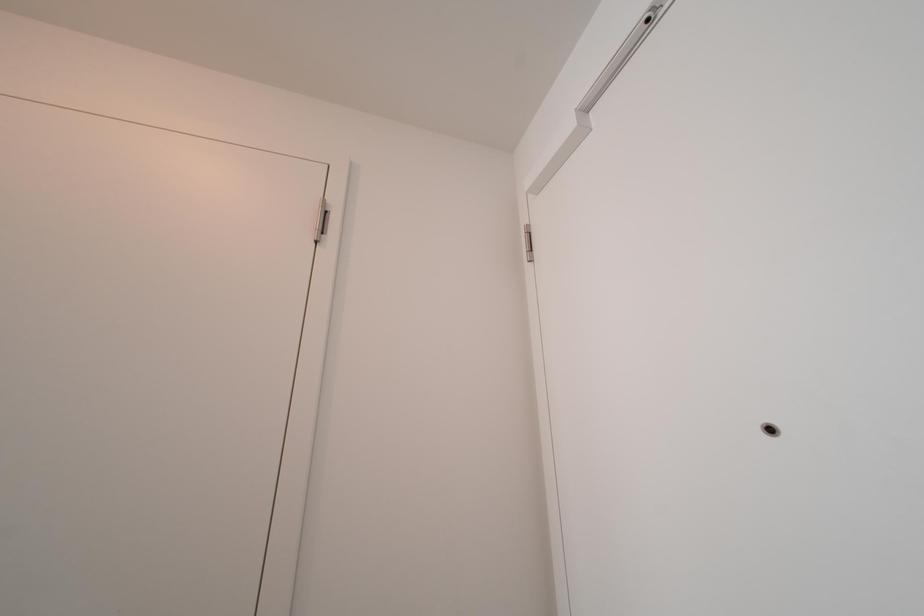
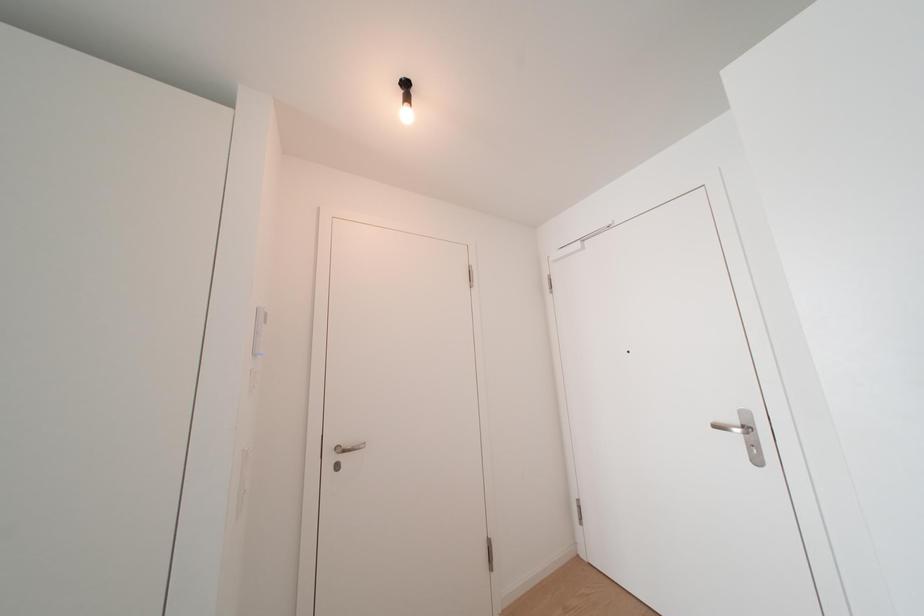
What movement of the cameraman would produce the second image?

The cameraman walked toward left, backward.